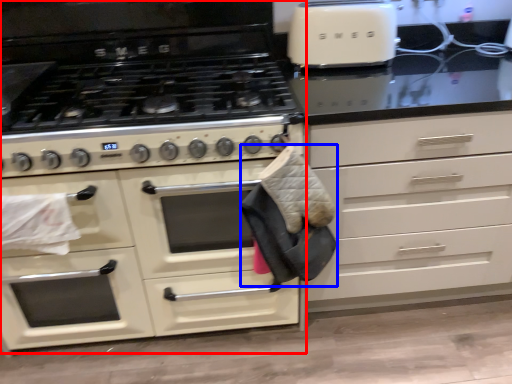
Question: Among these objects, which one is farthest to the camera, cabinetry (highlighted by a red box) or material (highlighted by a blue box)?

Choices:
 (A) cabinetry
 (B) material

Answer: (A)